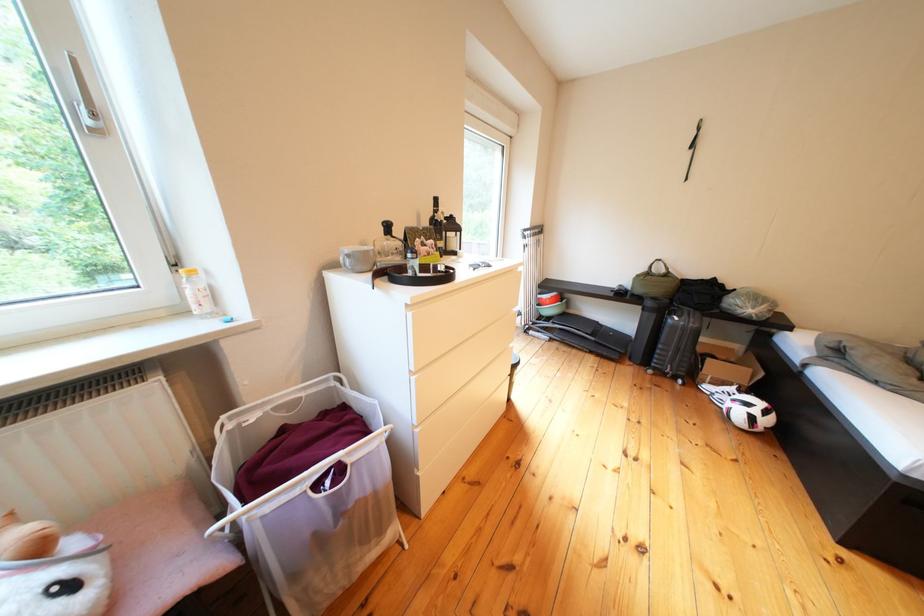
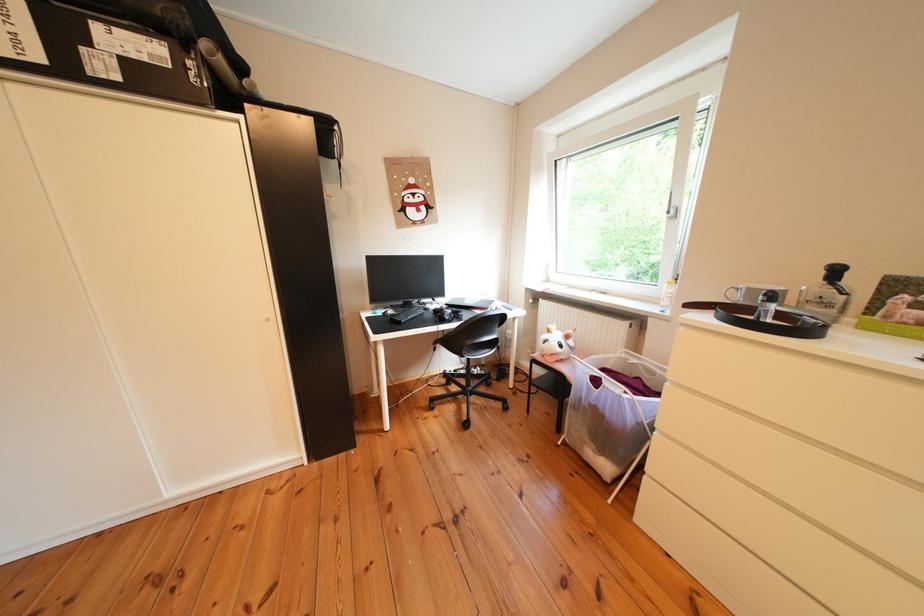
In the second image, find the point that corresponds to pixel 362 260 in the first image.

(751, 294)